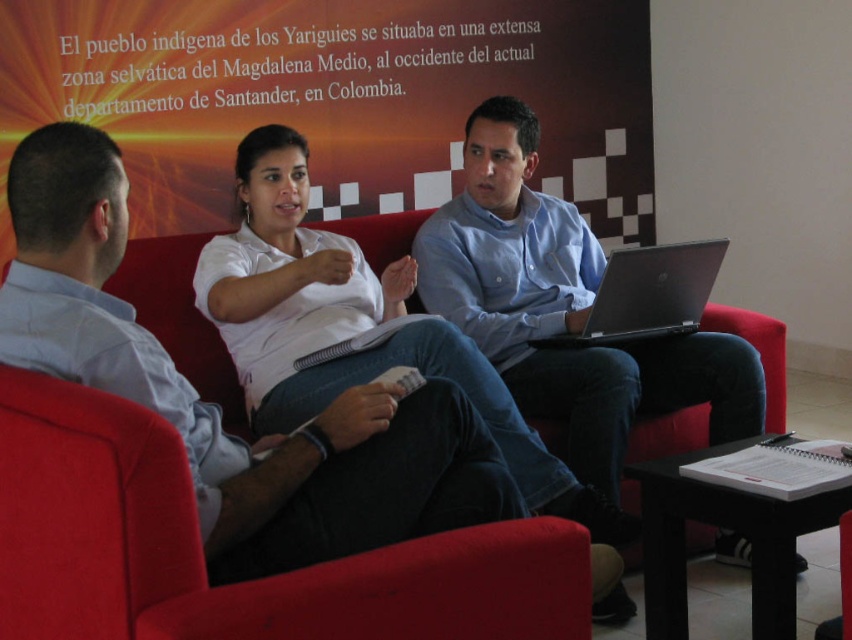
Question: Based on their relative distances, which object is nearer to the silver metallic laptop at center?

Choices:
 (A) matte fabric armchair at lower left
 (B) red fabric couch at center

Answer: (B)

Question: Is blue denim jeans at center above silver metallic laptop at center?

Choices:
 (A) no
 (B) yes

Answer: (A)

Question: Which point is closer to the camera?

Choices:
 (A) (684, 291)
 (B) (488, 417)

Answer: (B)

Question: Which object appears closest to the camera in this image?

Choices:
 (A) silver metallic laptop at center
 (B) matte fabric armchair at lower left
 (C) blue denim jeans at center

Answer: (B)

Question: Can you confirm if blue denim jeans at center is positioned to the right of white cotton shirt at center?

Choices:
 (A) yes
 (B) no

Answer: (A)

Question: Is the position of blue denim jeans at center more distant than that of white cotton shirt at center?

Choices:
 (A) no
 (B) yes

Answer: (B)